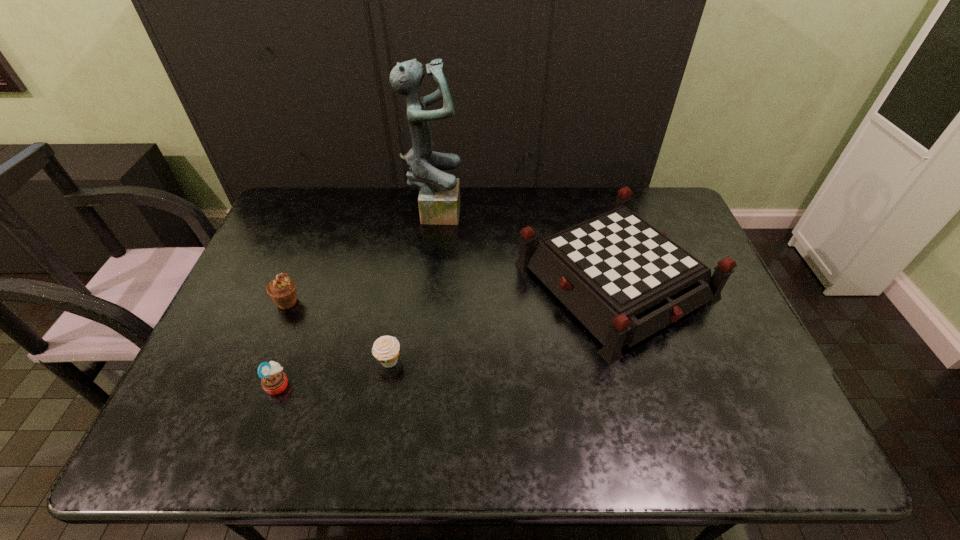
Where is `the closest object to the farthest muffin`? The height and width of the screenshot is (540, 960). the closest object to the farthest muffin is located at coordinates click(x=274, y=381).

This screenshot has width=960, height=540. What are the coordinates of `the third closest object to the farthest muffin` in the screenshot? It's located at (439, 198).

What are the coordinates of `muffin that is the second closest one to the rightmost muffin` in the screenshot? It's located at (282, 290).

I want to click on muffin that stands as the second closest to the checkerboard, so click(x=274, y=381).

What are the coordinates of `vacant space that satisfies the following two spatial constraints: 1. on the back side of the rightmost object; 2. on the right side of the farthest muffin` in the screenshot? It's located at (296, 281).

This screenshot has height=540, width=960. In order to click on vacant space that satisfies the following two spatial constraints: 1. on the face of the rightmost object; 2. on the left side of the tallest object in this screenshot , I will do `click(427, 281)`.